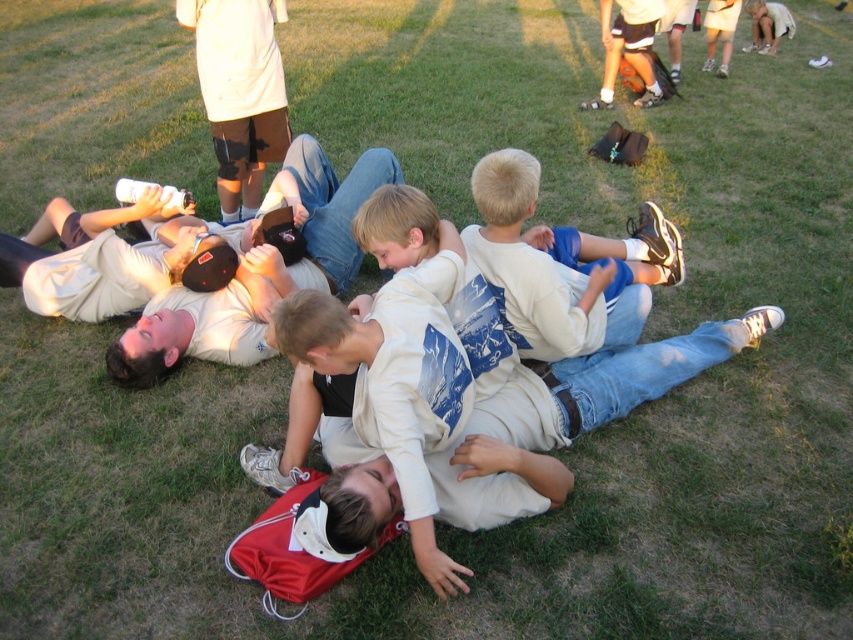
Can you confirm if white cotton shirt at center is smaller than light beige shirt at upper right?

Actually, white cotton shirt at center might be larger than light beige shirt at upper right.

Measure the distance between point (556,259) and camera.

Point (556,259) is 11.91 feet from camera.

In order to click on white cotton shirt at center in this screenshot , I will do `click(563, 266)`.

Does point (233, 134) lie in front of point (613, 70)?

Yes, it is.

Between white matte knee pad at upper center and matte black shorts at upper center, which one has more height?

white matte knee pad at upper center is taller.

Where is `white matte knee pad at upper center`? The image size is (853, 640). white matte knee pad at upper center is located at coordinates (239, 92).

At what (x,y) coordinates should I click in order to perform the action: click on white matte knee pad at upper center. Please return your answer as a coordinate pair (x, y). Looking at the image, I should click on (239, 92).

Which of these two, white matte shirt at center or matte khaki cap at upper left, stands taller?

Standing taller between the two is white matte shirt at center.

The image size is (853, 640). Describe the element at coordinates (321, 214) in the screenshot. I see `white matte shirt at center` at that location.

Where is `white matte shirt at center`? This screenshot has height=640, width=853. white matte shirt at center is located at coordinates (321, 214).

Locate an element on the screen. This screenshot has height=640, width=853. white matte shirt at center is located at coordinates (321, 214).